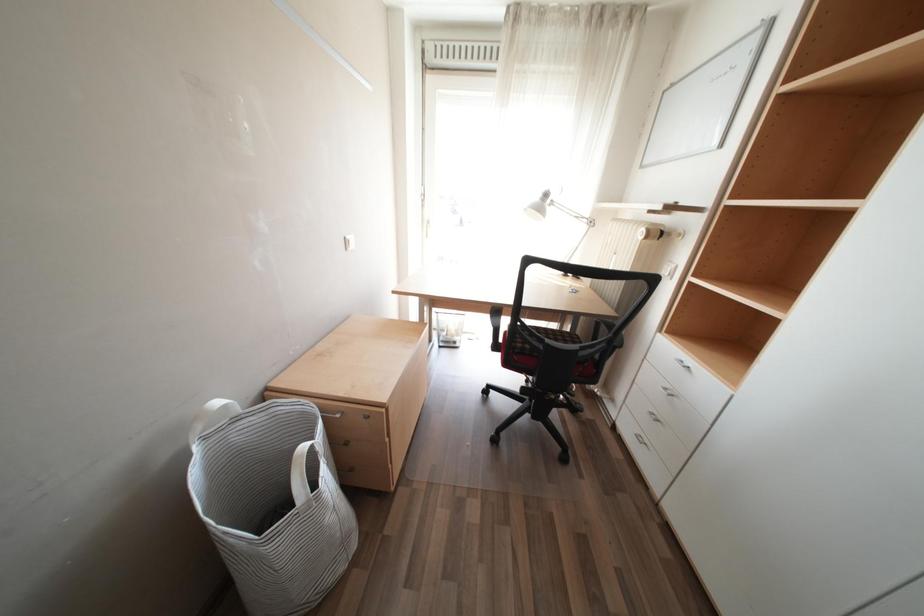
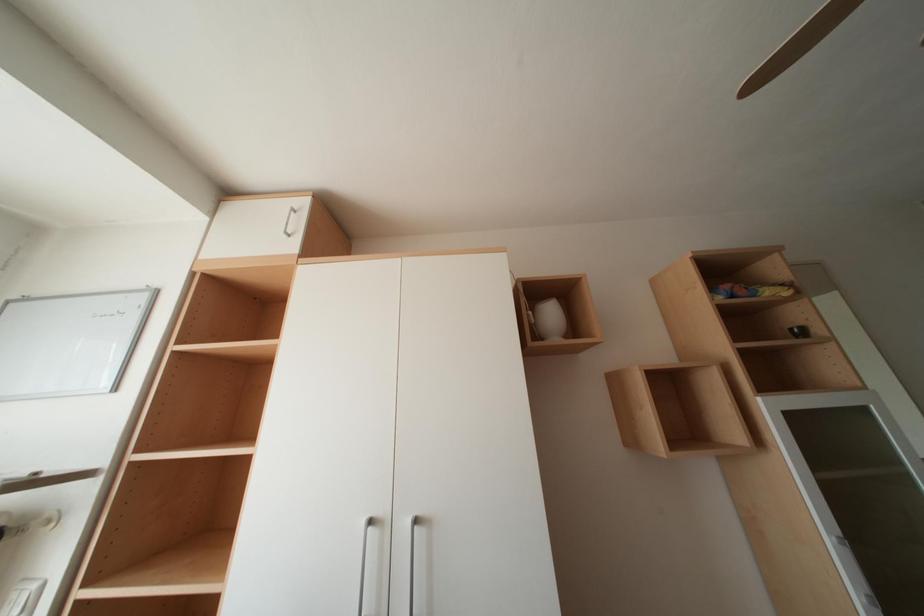
Question: The first image is from the beginning of the video and the second image is from the end. How did the camera likely rotate when shooting the video?

Choices:
 (A) Left
 (B) Right
 (C) Up
 (D) Down

Answer: (B)